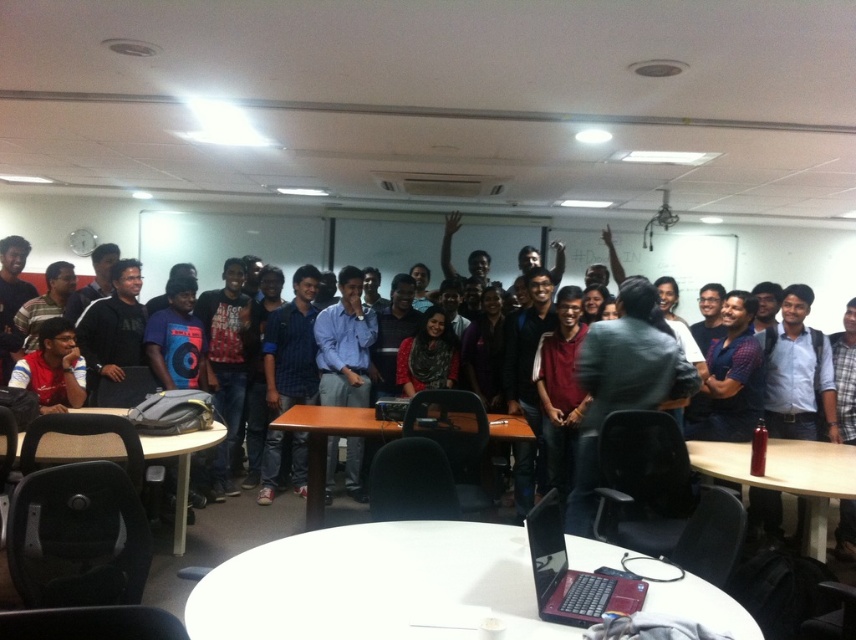
Consider the image. Between brown wooden table at center and matte red shirt at lower left, which one appears on the right side from the viewer's perspective?

brown wooden table at center

Between point (302, 422) and point (55, 355), which one is positioned behind?

The point (55, 355) is behind.

Locate an element on the screen. The image size is (856, 640). brown wooden table at center is located at coordinates (325, 442).

Describe the element at coordinates (786, 476) in the screenshot. The height and width of the screenshot is (640, 856). I see `metallic silver table at lower right` at that location.

Can you confirm if metallic silver table at lower right is bigger than matte red shirt at lower left?

Correct, metallic silver table at lower right is larger in size than matte red shirt at lower left.

Does point (773, 490) come farther from viewer compared to point (31, 358)?

That is False.

Locate an element on the screen. This screenshot has width=856, height=640. metallic silver table at lower right is located at coordinates [786, 476].

Can you confirm if metallic silver table at lower right is positioned to the left of brown wooden table at center?

No, metallic silver table at lower right is not to the left of brown wooden table at center.

Consider the image. Is metallic silver table at lower right further to the viewer compared to brown wooden table at center?

No, metallic silver table at lower right is closer to the viewer.

Which is behind, point (777, 476) or point (282, 417)?

Point (282, 417)

Where is `metallic silver table at lower right`? This screenshot has width=856, height=640. metallic silver table at lower right is located at coordinates (786, 476).